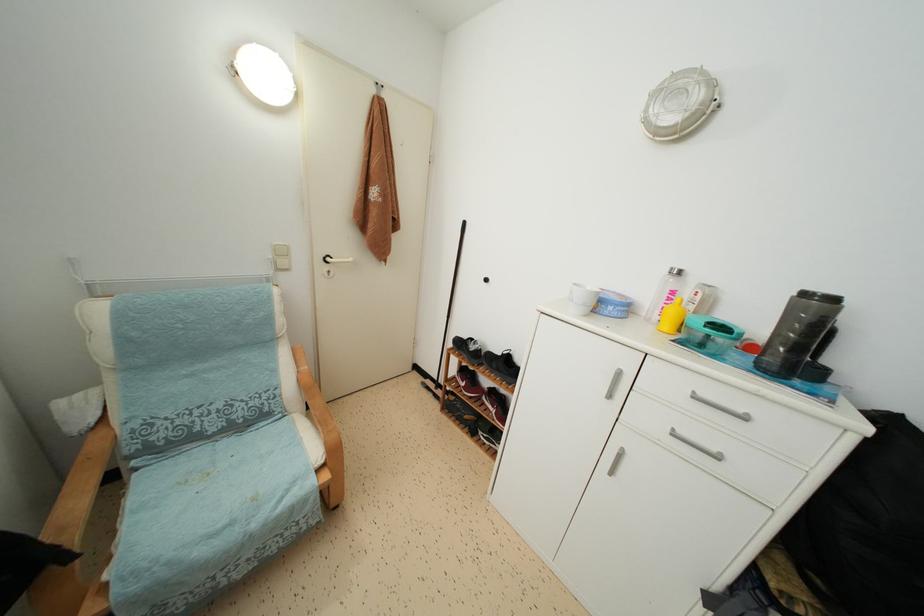
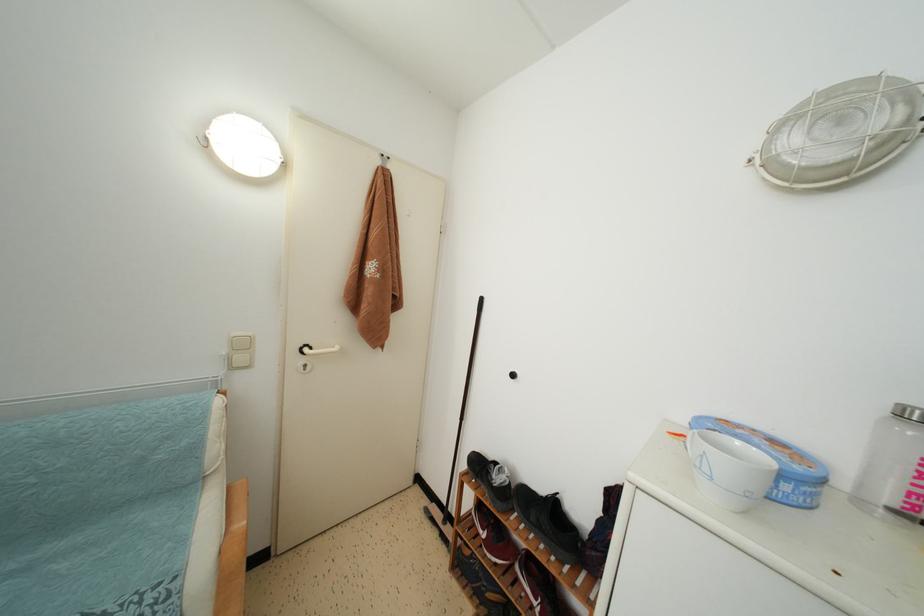
Question: Based on the continuous images, in which direction is the camera rotating? Reply with the corresponding letter.

Choices:
 (A) Left
 (B) Right
 (C) Up
 (D) Down

Answer: (C)